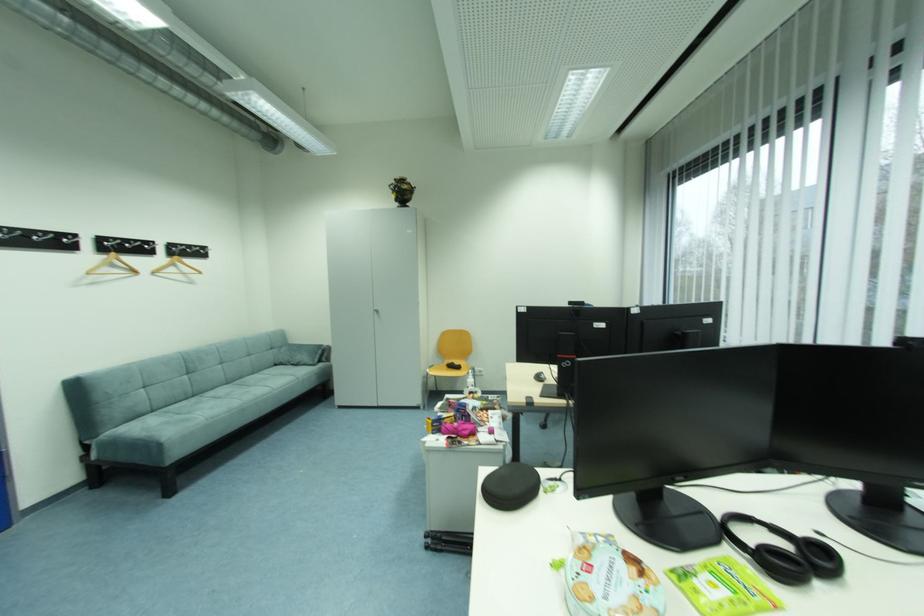
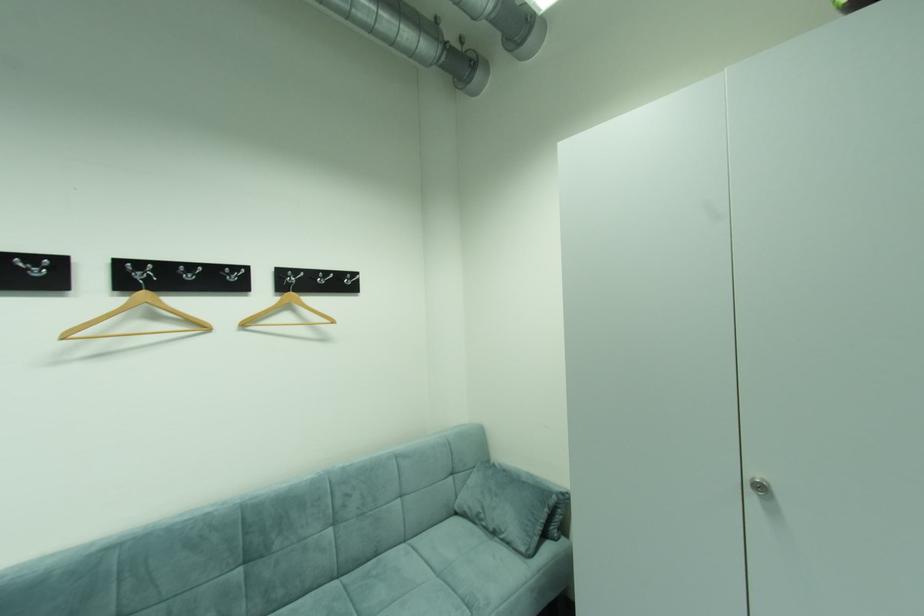
Where in the second image is the point corresponding to the point at 283,367 from the first image?

(464, 514)